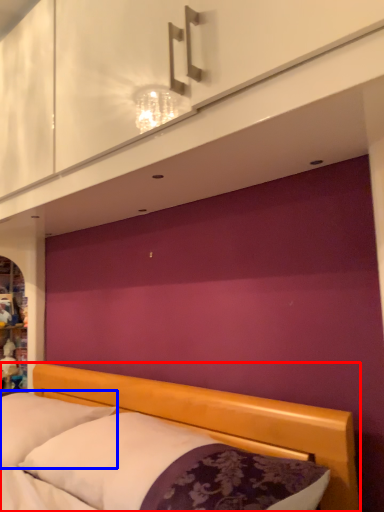
Question: Which point is further to the camera, bed (highlighted by a red box) or pillow (highlighted by a blue box)?

Choices:
 (A) bed
 (B) pillow

Answer: (B)